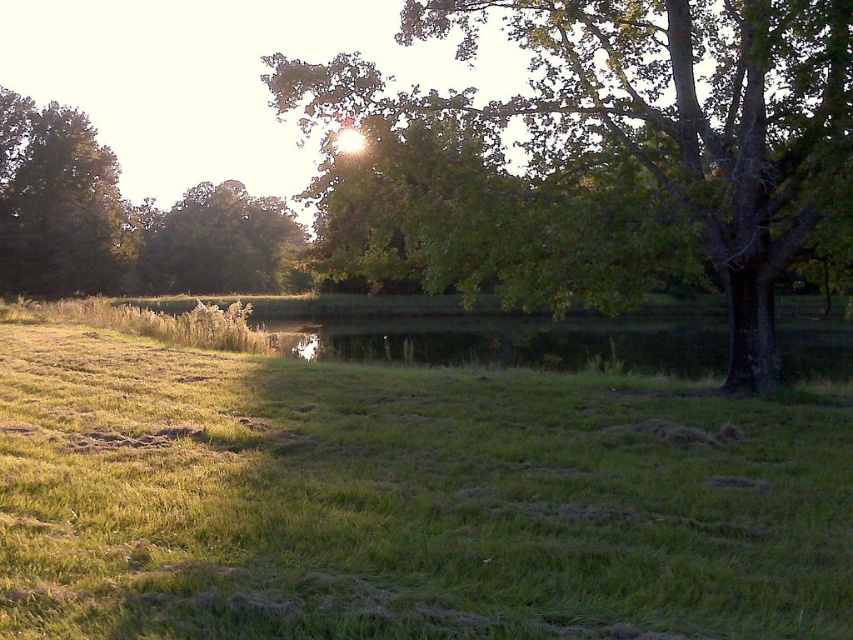
Question: Which of the following is the closest to the observer?

Choices:
 (A) green grassy at center
 (B) green leafy tree at upper right
 (C) green leafy tree at upper left
 (D) green leafy tree at left

Answer: (A)

Question: Which of these objects is positioned farthest from the green leafy tree at upper right?

Choices:
 (A) green grassy at center
 (B) green leafy tree at left
 (C) green leafy tree at upper left

Answer: (B)

Question: Does green leafy tree at upper right have a smaller size compared to green leafy tree at upper left?

Choices:
 (A) no
 (B) yes

Answer: (A)

Question: Among these points, which one is nearest to the camera?

Choices:
 (A) (567, 252)
 (B) (247, 481)
 (C) (16, 172)

Answer: (B)

Question: Does green grassy at center have a greater width compared to green leafy tree at upper right?

Choices:
 (A) no
 (B) yes

Answer: (A)

Question: Can you confirm if green leafy tree at upper right is positioned to the left of green leafy tree at left?

Choices:
 (A) yes
 (B) no

Answer: (B)